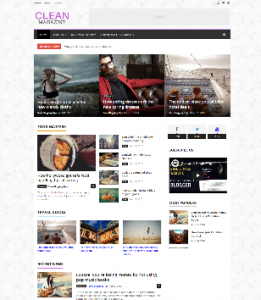
Where is `bar`? The width and height of the screenshot is (261, 300). bar is located at coordinates (156, 35).